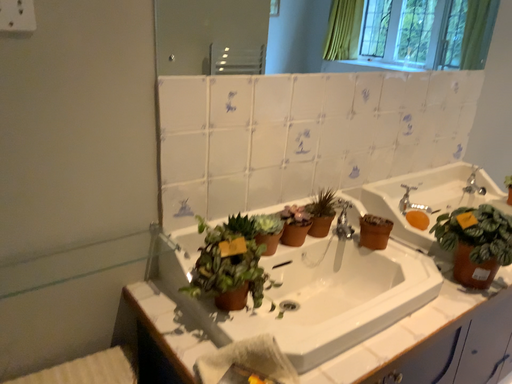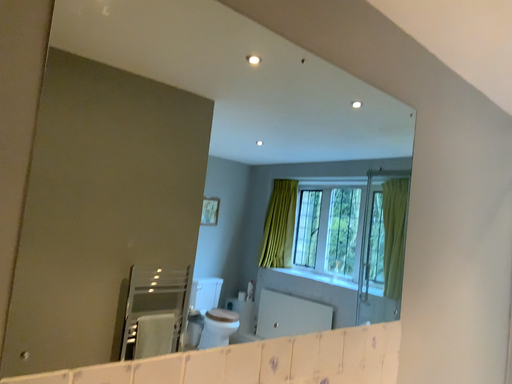
Question: How did the camera likely rotate when shooting the video?

Choices:
 (A) rotated left
 (B) rotated right

Answer: (B)